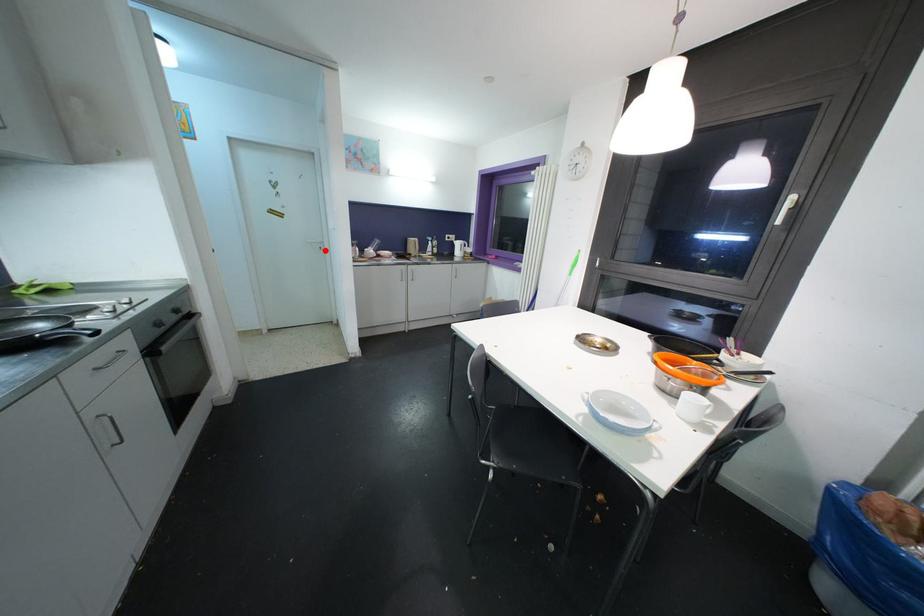
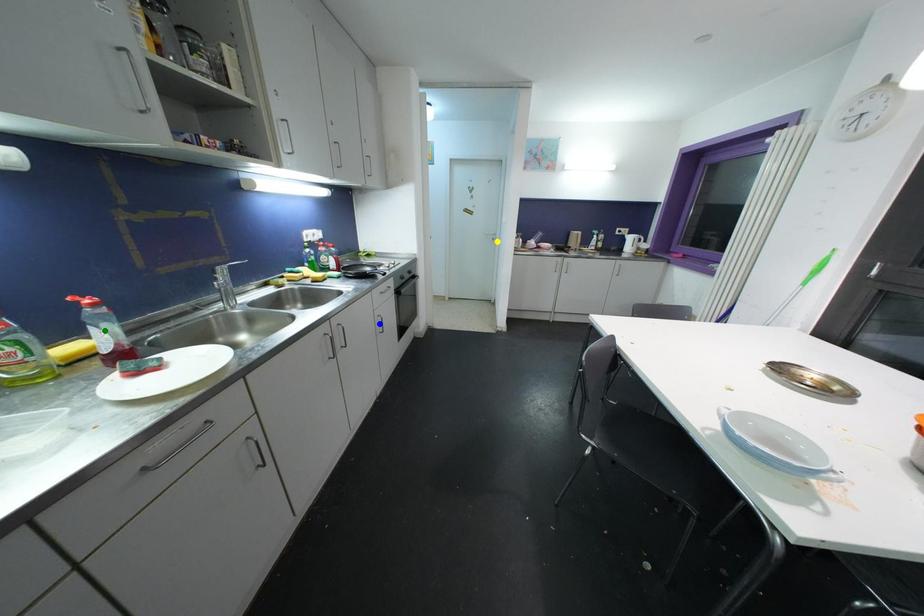
Question: I am providing you with two images of the same scene from different viewpoints. A red point is marked on the first image. You are given multiple points on the second image. Which point in image 2 represents the same 3d spot as the red point in image 1?

Choices:
 (A) yellow point
 (B) green point
 (C) blue point

Answer: (A)